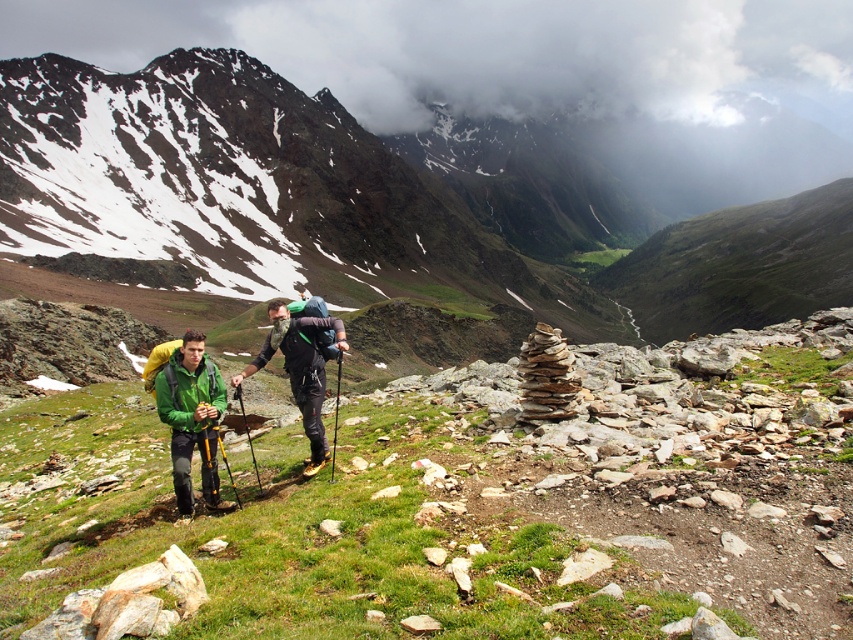
Does green grassy mountain at center come in front of matte green jacket at center?

No, green grassy mountain at center is behind matte green jacket at center.

Based on the photo, which of these two, green grassy mountain at center or matte green jacket at center, stands taller?

green grassy mountain at center

Is point (35, 113) less distant than point (289, 339)?

No, it is not.

At what (x,y) coordinates should I click in order to perform the action: click on green grassy mountain at center. Please return your answer as a coordinate pair (x, y). This screenshot has width=853, height=640. Looking at the image, I should click on (376, 204).

Between green matte jacket at center and green matte jacket at lower left, which one is positioned lower?

Positioned lower is green matte jacket at lower left.

Does point (299, 358) come farther from viewer compared to point (212, 401)?

Yes.

Does point (296, 388) come in front of point (196, 349)?

That is False.

Where is `green matte jacket at center`? Image resolution: width=853 pixels, height=640 pixels. green matte jacket at center is located at coordinates (300, 368).

Between green grassy mountain at center and green matte jacket at lower left, which one appears on the left side from the viewer's perspective?

From the viewer's perspective, green matte jacket at lower left appears more on the left side.

Who is more forward, (401, 228) or (212, 433)?

Positioned in front is point (212, 433).

Locate an element on the screen. The width and height of the screenshot is (853, 640). green grassy mountain at center is located at coordinates (376, 204).